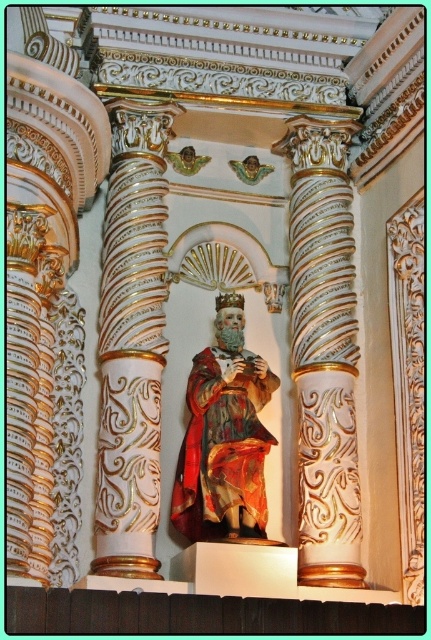
You are standing in the ornate interior space and want to walk from point A to point B. Point A is located at coordinate point (x=312, y=188) and point B is at coordinate point (x=187, y=528). Which point is closer to you when you first enter the space?

Point A at coordinate point (x=312, y=188) is closer to you because it is further to the viewer than point B at coordinate point (x=187, y=528).

You are an interior designer planning to install a new lighting fixture in this space. The fixture requires a mounting point that is at least 3 meters tall. Given the white glossy column at center and the red velvet robe at center, which object would be suitable for mounting the fixture based on their heights?

The white glossy column at center is taller than the red velvet robe at center, so the white glossy column at center would be suitable for mounting the lighting fixture as it meets the height requirement.

You are standing in the ornate interior space and want to locate the white marble column at center. Based on the 2D coordinates provided, can you determine its position relative to the center of the image?

The white marble column at center is located at coordinates approximately 55 percent from the left edge and 75 percent from the top edge of the image, meaning it is positioned slightly to the right and lower than the exact center.